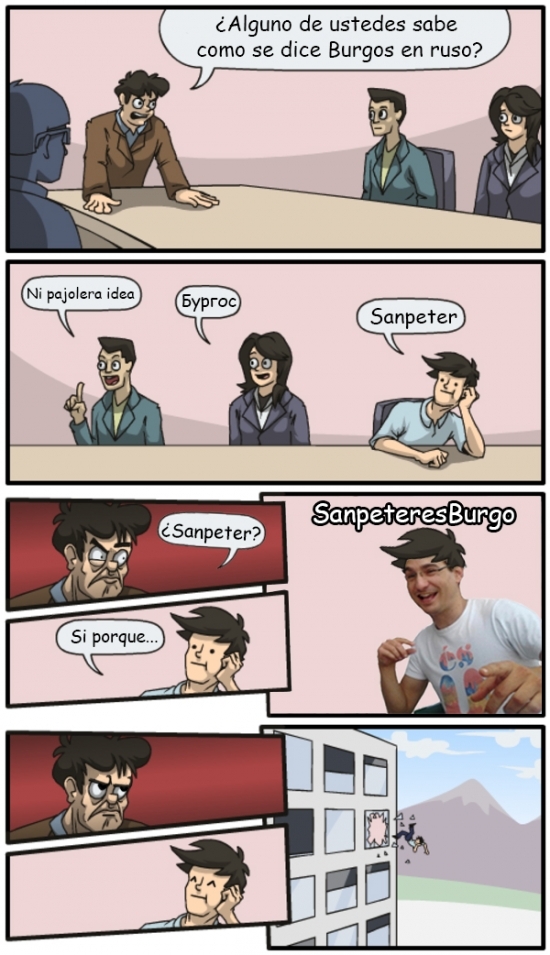
Locate an element on the screen. broken window is located at coordinates (379, 836).